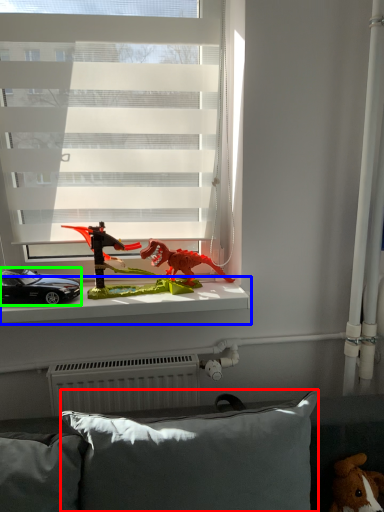
Question: Considering the real-world distances, which object is closest to pillow (highlighted by a red box)? window sill (highlighted by a blue box) or car (highlighted by a green box).

Choices:
 (A) window sill
 (B) car

Answer: (A)